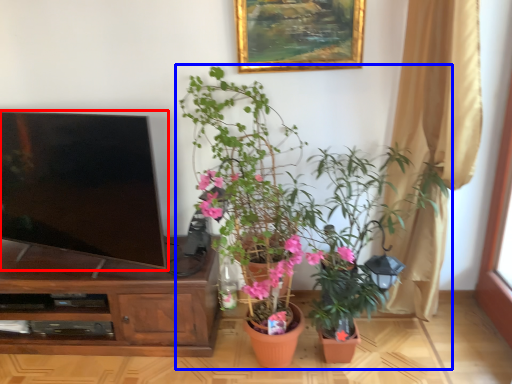
Question: Which object appears farthest to the camera in this image, television (highlighted by a red box) or houseplant (highlighted by a blue box)?

Choices:
 (A) television
 (B) houseplant

Answer: (A)